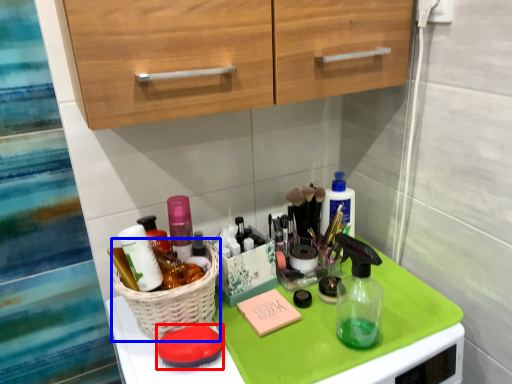
Question: Which of the following is the farthest to the observer, soap (highlighted by a red box) or basket (highlighted by a blue box)?

Choices:
 (A) soap
 (B) basket

Answer: (A)